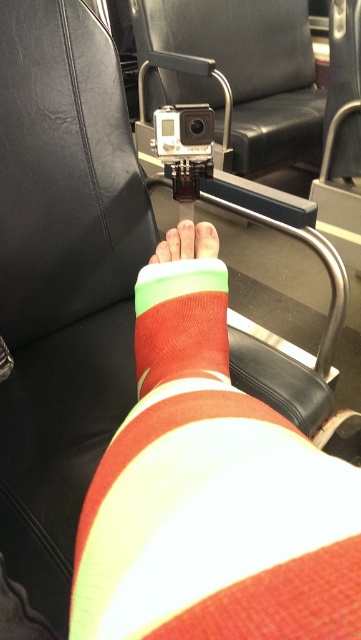
You are designing a layout for a public transportation seat. The seat has an armrest where a camera is mounted. You need to place a new cup holder such that it is exactly 0.1 units to the right of the black leather chair at upper center. What are the coordinates of the cup holder?

The coordinates of the cup holder would be at point (248, 134) since the black leather chair at upper center is at point (248, 70) and moving 0.1 units to the right adds 0.1 to the x coordinate.